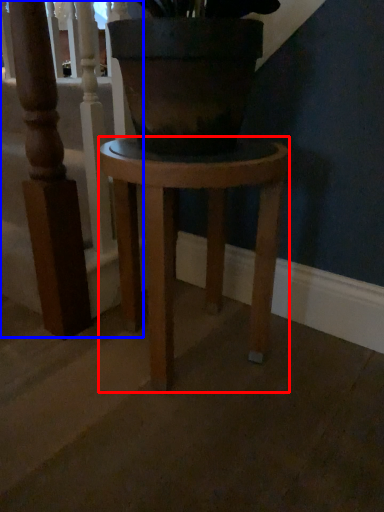
Question: Which object is closer to the camera taking this photo, stool (highlighted by a red box) or rail (highlighted by a blue box)?

Choices:
 (A) stool
 (B) rail

Answer: (A)